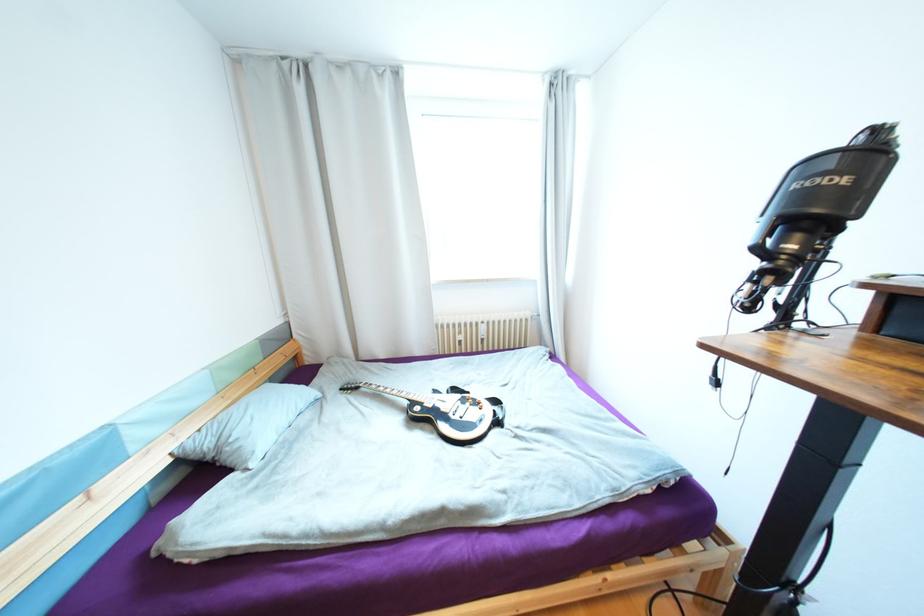
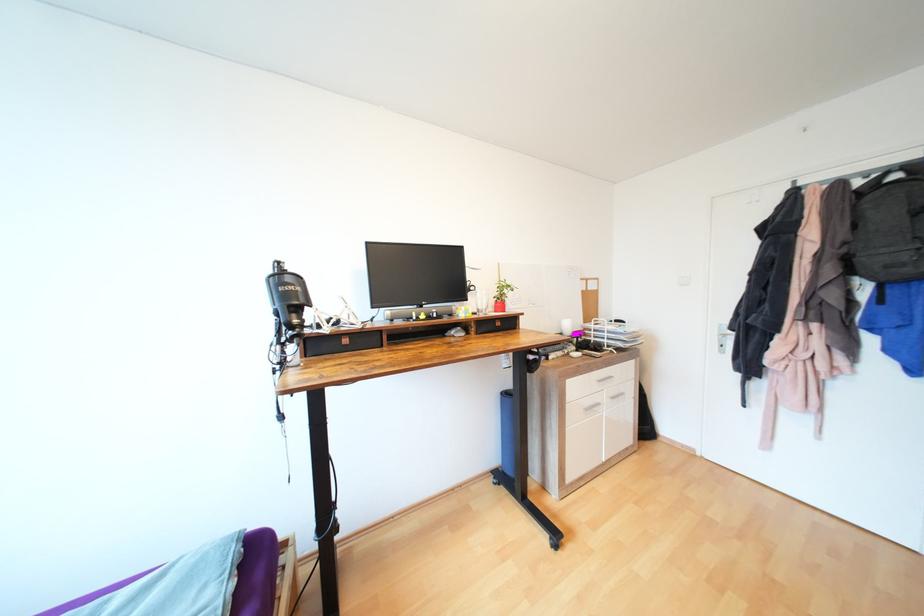
Question: The camera is either moving clockwise (left) or counter-clockwise (right) around the object. The first image is from the beginning of the video and the second image is from the end. Is the camera moving left or right when shooting the video?

Choices:
 (A) Left
 (B) Right

Answer: (A)